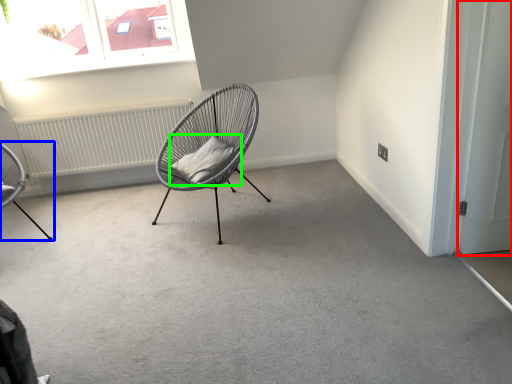
Question: Which is farther away from door (highlighted by a red box)? chair (highlighted by a blue box) or pillow (highlighted by a green box)?

Choices:
 (A) chair
 (B) pillow

Answer: (A)